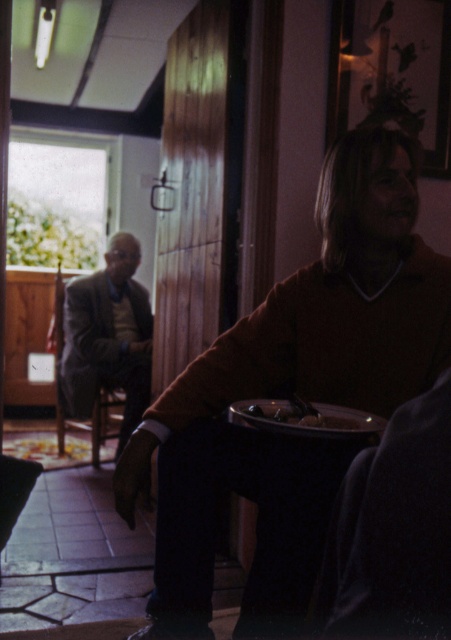
Question: Is light brown woolen suit at left thinner than shiny metallic bowl at center?

Choices:
 (A) yes
 (B) no

Answer: (B)

Question: Which object is closer to the camera taking this photo?

Choices:
 (A) metallic silver tray at lower center
 (B) light brown woolen suit at left
 (C) shiny metallic bowl at center
 (D) matte brown sweater at center

Answer: (A)

Question: Which object is positioned farthest from the light brown woolen suit at left?

Choices:
 (A) matte brown sweater at center
 (B) metallic silver tray at lower center
 (C) shiny metallic bowl at center

Answer: (C)

Question: Is matte brown sweater at center to the left of light brown woolen suit at left from the viewer's perspective?

Choices:
 (A) yes
 (B) no

Answer: (B)

Question: Which point is closer to the camera?

Choices:
 (A) (355, 420)
 (B) (346, 419)

Answer: (A)

Question: Is light brown woolen suit at left to the right of shiny metallic bowl at center from the viewer's perspective?

Choices:
 (A) yes
 (B) no

Answer: (B)